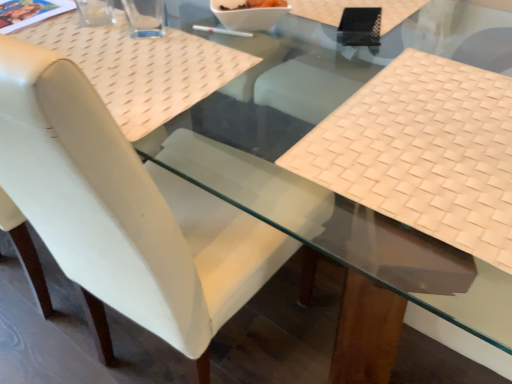
The height and width of the screenshot is (384, 512). I want to click on vacant area situated below beige woven mat at right (from a real-world perspective), so click(414, 135).